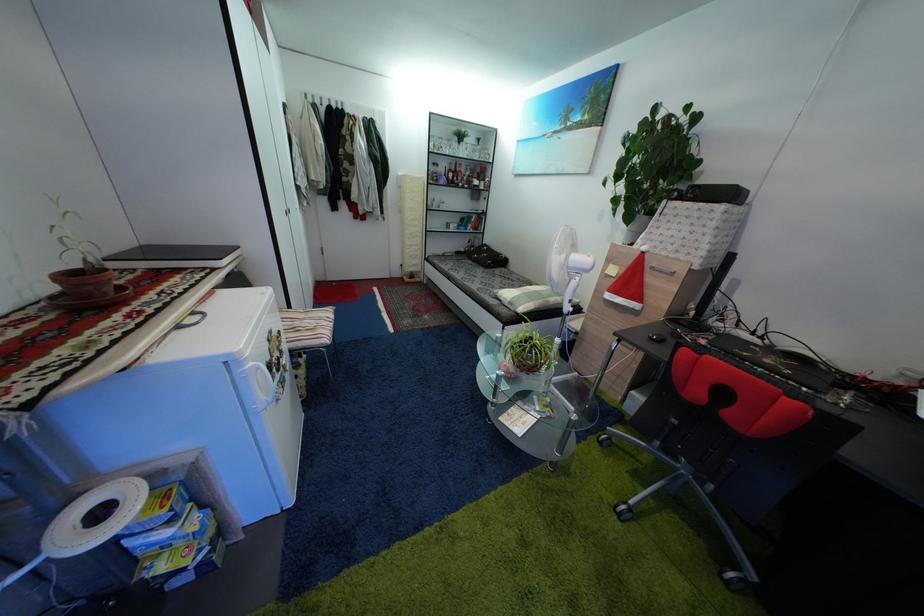
What do you see at coordinates (260, 383) in the screenshot? I see `the white refrigerator handle` at bounding box center [260, 383].